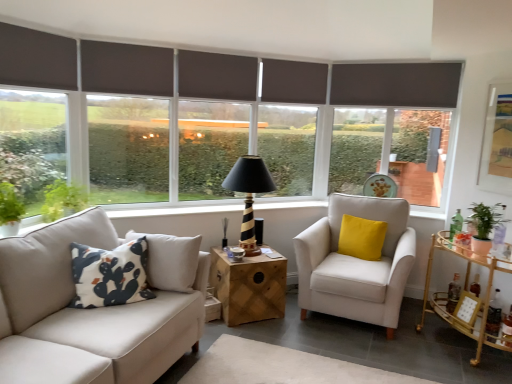
Where is `vacant point above dark gray roller blind at center, positioned as the 3th window in left-to-right order (from a real-world perspective)`? This screenshot has height=384, width=512. vacant point above dark gray roller blind at center, positioned as the 3th window in left-to-right order (from a real-world perspective) is located at coordinates (215, 51).